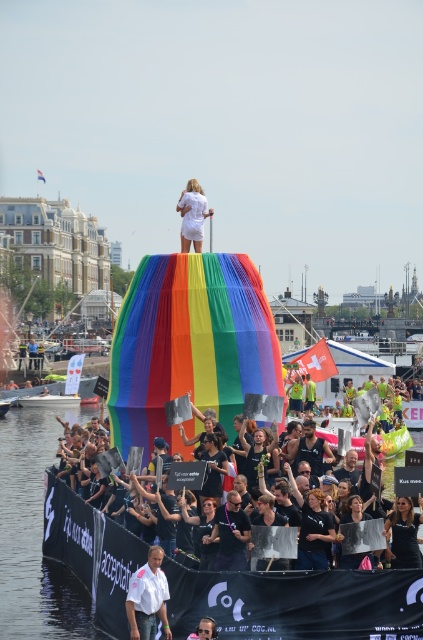
You are a photographer at the Pride parade aiming to capture a photo of the white matte dress at upper center and the white plastic boat at center. Which object should you focus on first if you want to include both in your shot without moving the camera?

The white matte dress at upper center is located above the white plastic boat at center, so you should focus on the white plastic boat at center first to ensure both are in frame.

You are a photographer standing on the canal bank. You want to capture a photo of the white plastic boat at center and the black matte shirt at center such that both are clearly visible. Based on their positions, which object should you focus on first to ensure both are in focus?

The black matte shirt at center is in front of the white plastic boat at center, so you should focus on the black matte shirt at center first to ensure both are in focus.

From the picture: You are a photographer at the Pride parade and want to ensure both the white matte dress at upper center and the black matte shirt at center are clearly visible in your photo. Since you can only focus on one subject, which one should you choose to ensure the other remains recognizable in the background?

The white matte dress at upper center is larger in size compared to the black matte shirt at center, so focusing on the white matte dress at upper center will allow the smaller black matte shirt at center to still be recognizable in the background.